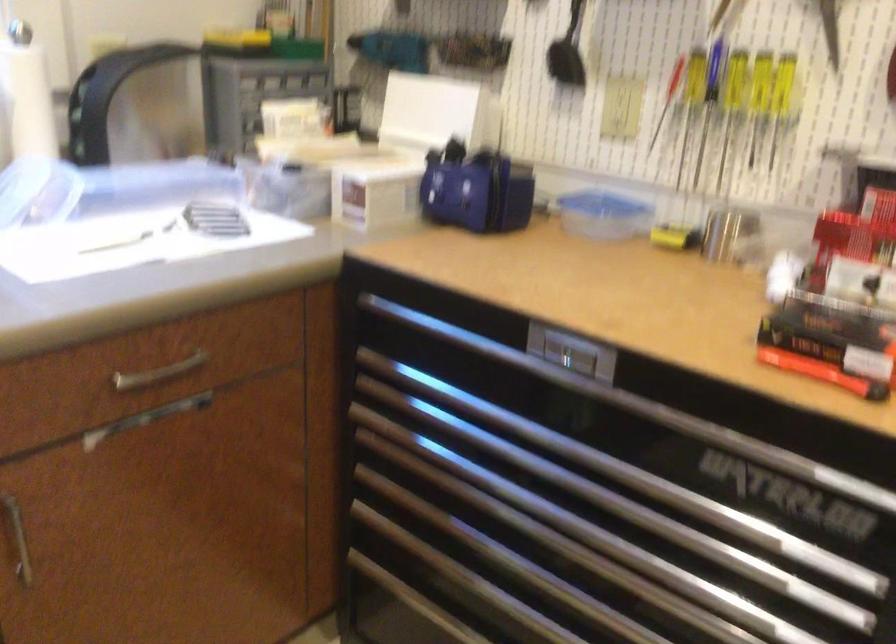
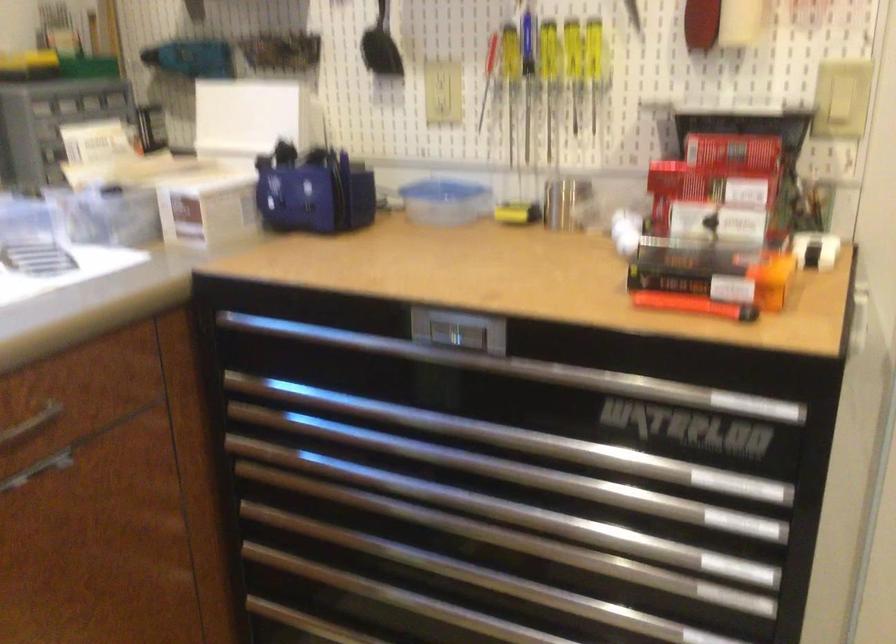
Question: The images are taken continuously from a first-person perspective. In which direction is your viewpoint rotating?

Choices:
 (A) Left
 (B) Right
 (C) Up
 (D) Down

Answer: (B)